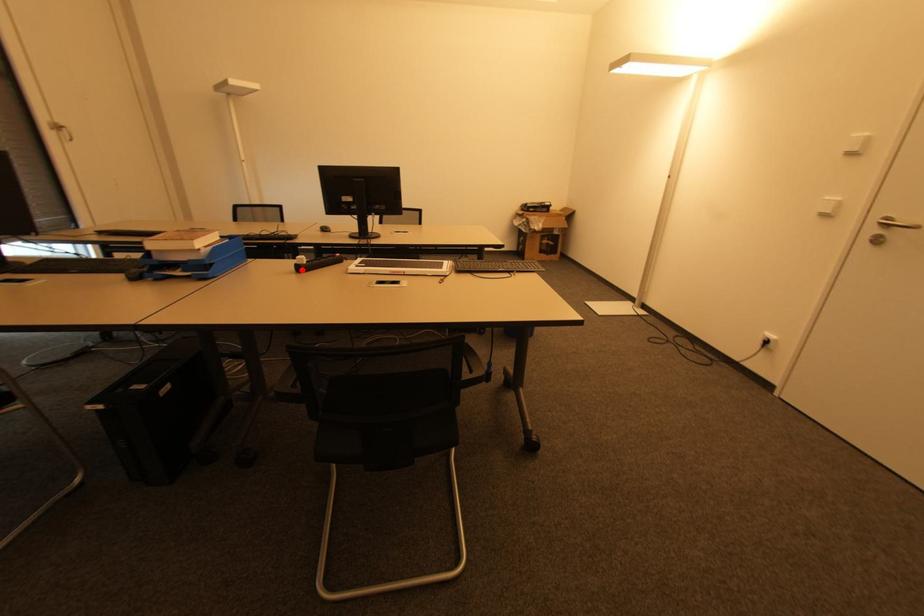
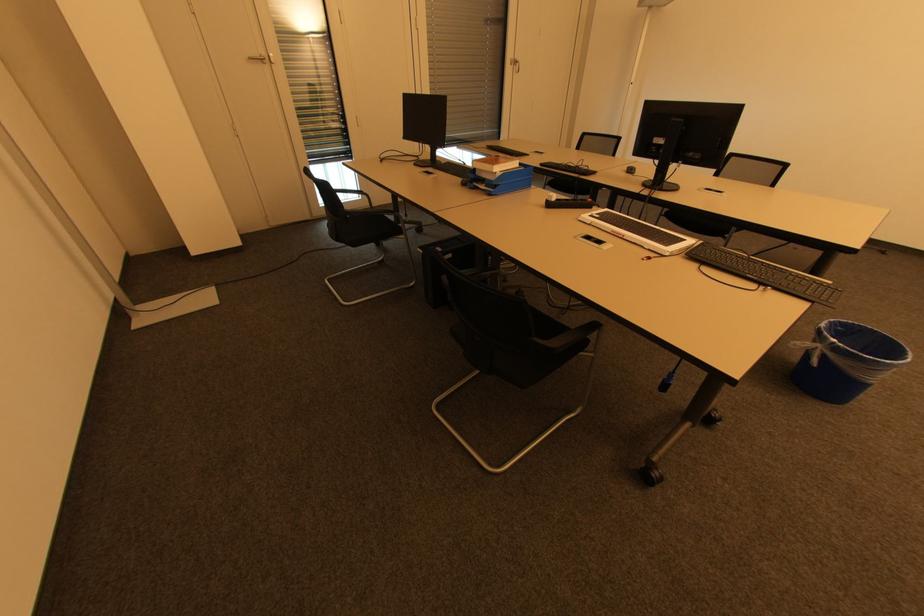
The point at the highlighted location is marked in the first image. Where is the corresponding point in the second image?

(551, 206)